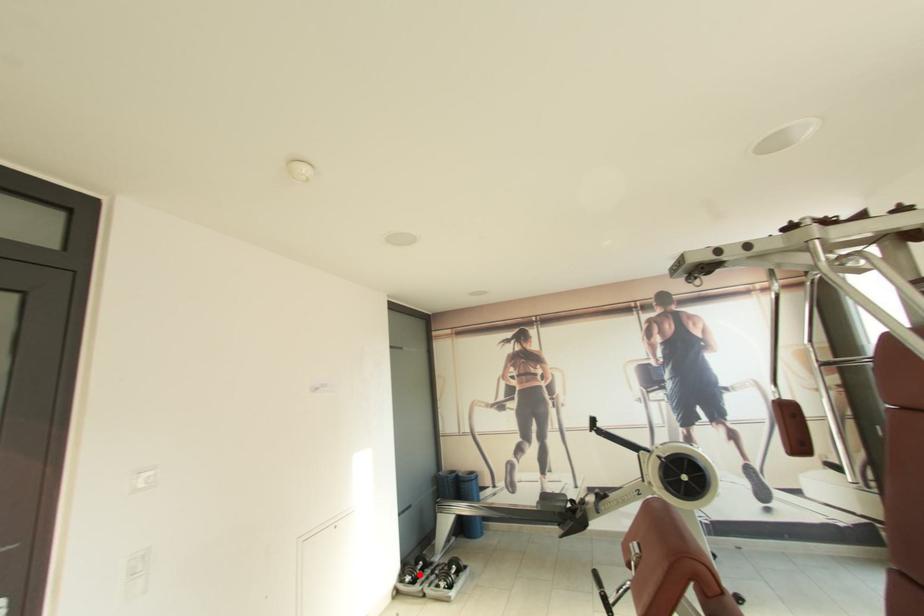
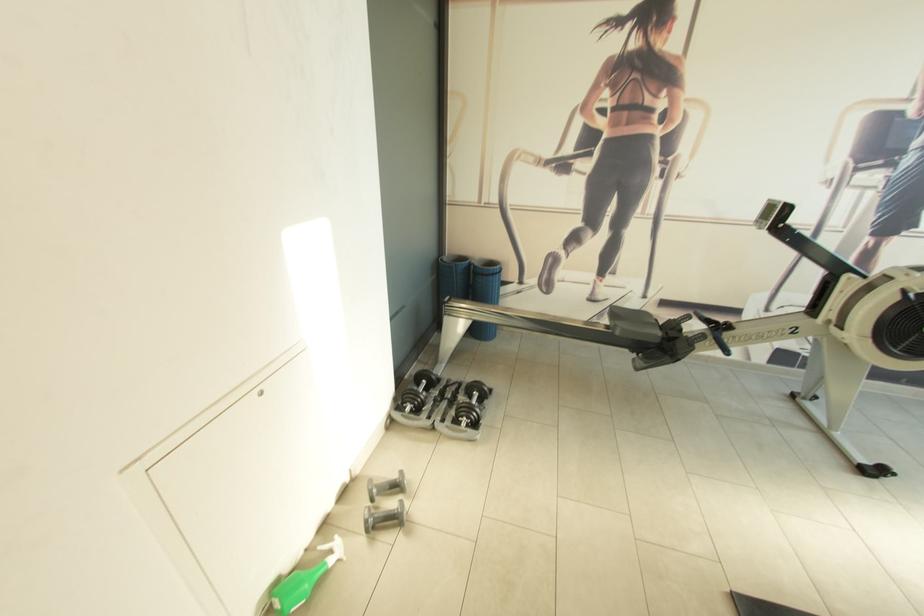
In the second image, find the point that corresponds to the highlighted location in the first image.

(424, 402)